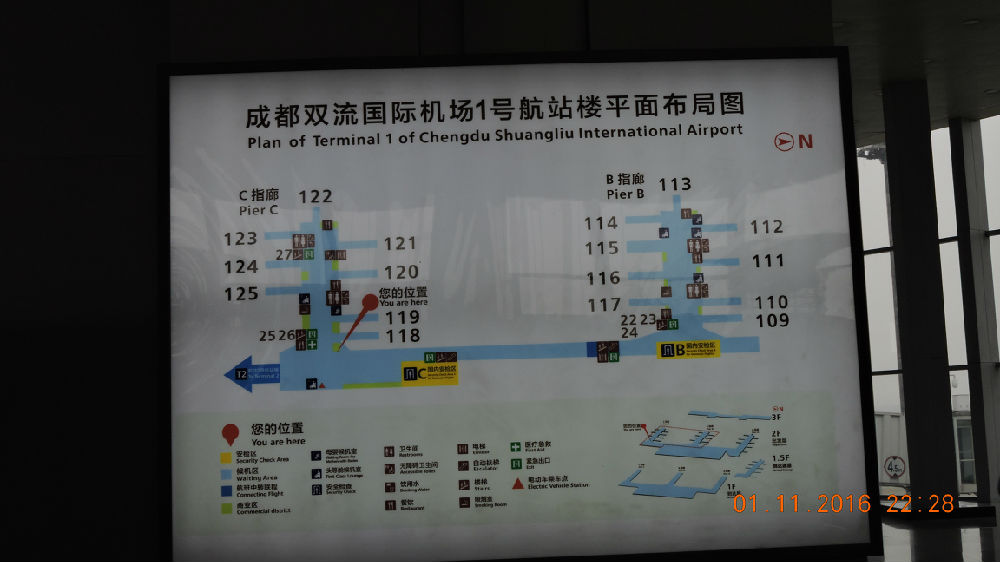
I want to click on tv screen, so click(x=518, y=310).